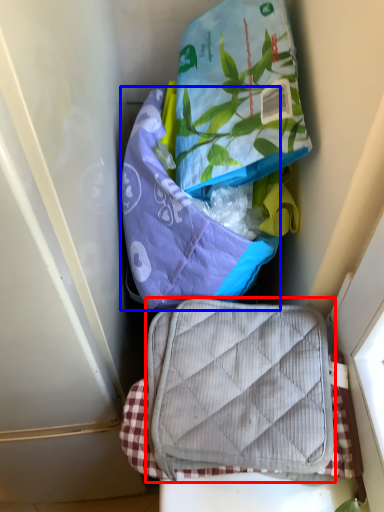
Question: Which of the following is the farthest to the observer, luggage and bags (highlighted by a red box) or pouch (highlighted by a blue box)?

Choices:
 (A) luggage and bags
 (B) pouch

Answer: (B)